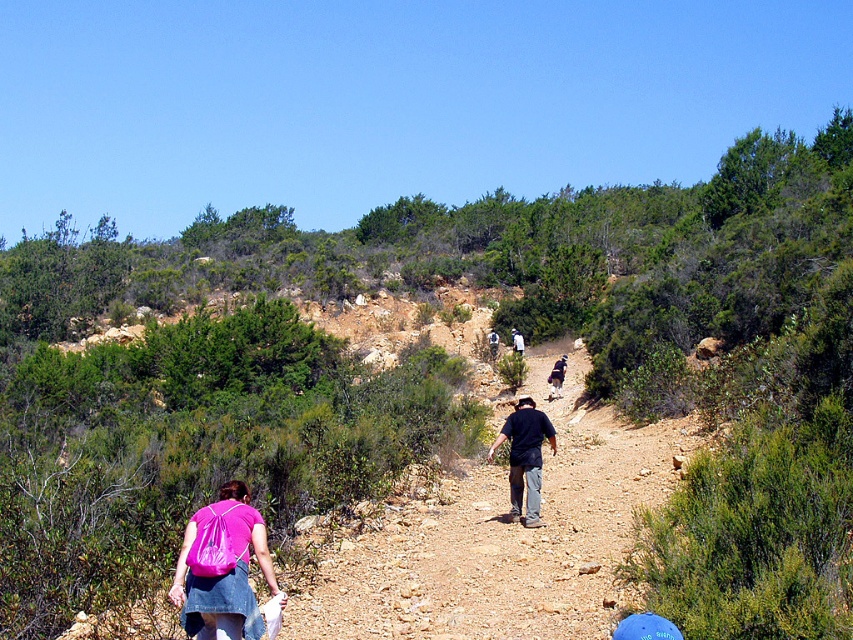
Question: Is the position of pink fabric backpack at lower left more distant than that of dark blue shirt at center?

Choices:
 (A) yes
 (B) no

Answer: (B)

Question: Which point is closer to the camera taking this photo?

Choices:
 (A) (540, 524)
 (B) (258, 513)

Answer: (B)

Question: Is pink fabric backpack at lower left in front of dark blue shirt at center?

Choices:
 (A) no
 (B) yes

Answer: (B)

Question: Which object is closer to the camera taking this photo?

Choices:
 (A) pink fabric backpack at lower left
 (B) dark blue shirt at center

Answer: (A)

Question: Is pink fabric backpack at lower left to the left of dark blue shirt at center from the viewer's perspective?

Choices:
 (A) no
 (B) yes

Answer: (B)